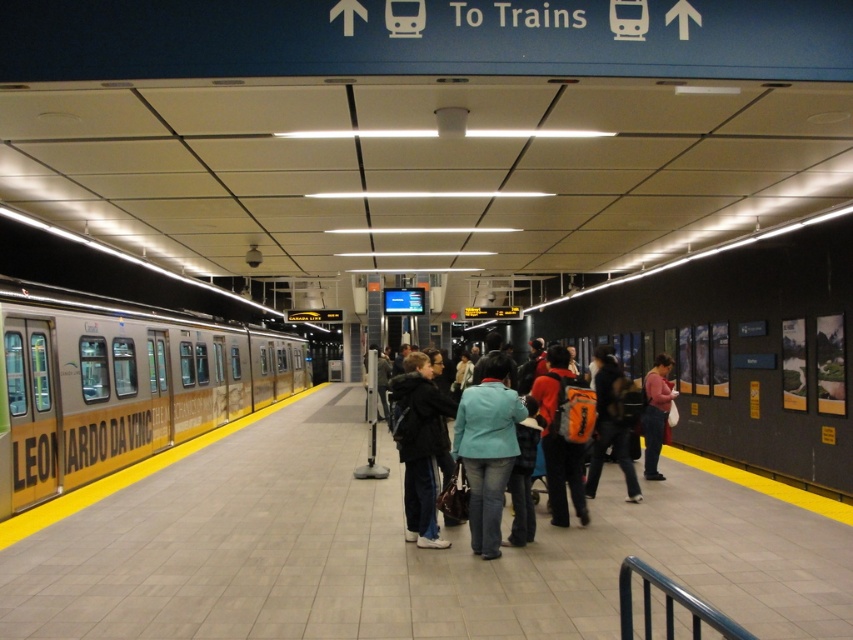
Question: Is yellow metallic train at left bigger than denim jacket at center?

Choices:
 (A) yes
 (B) no

Answer: (A)

Question: Which object is farther from the camera taking this photo?

Choices:
 (A) yellow metallic train at left
 (B) pink fabric bag at center
 (C) denim jacket at center

Answer: (B)

Question: Is yellow metallic train at left to the right of pink fabric bag at center from the viewer's perspective?

Choices:
 (A) yes
 (B) no

Answer: (B)

Question: Is yellow metallic train at left wider than pink fabric bag at center?

Choices:
 (A) no
 (B) yes

Answer: (B)

Question: Which object is positioned closest to the pink fabric bag at center?

Choices:
 (A) denim jacket at center
 (B) yellow metallic train at left

Answer: (A)

Question: Which point is farther to the camera?

Choices:
 (A) yellow metallic train at left
 (B) pink fabric bag at center

Answer: (B)